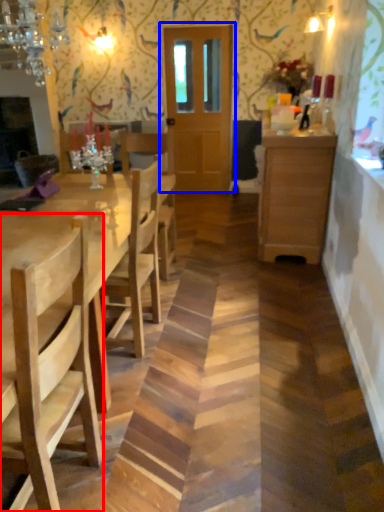
Question: Which object appears closest to the camera in this image, chair (highlighted by a red box) or door (highlighted by a blue box)?

Choices:
 (A) chair
 (B) door

Answer: (A)